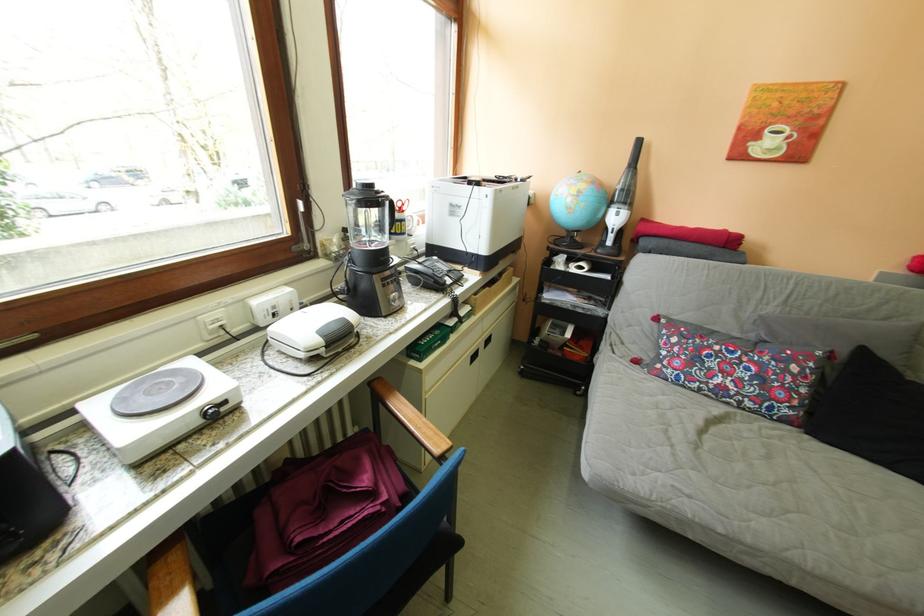
Where is `blender jar`? blender jar is located at coordinates (370, 211).